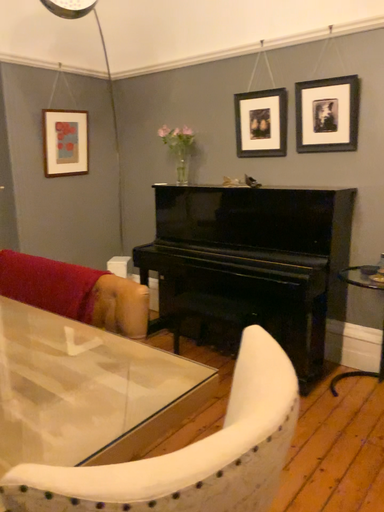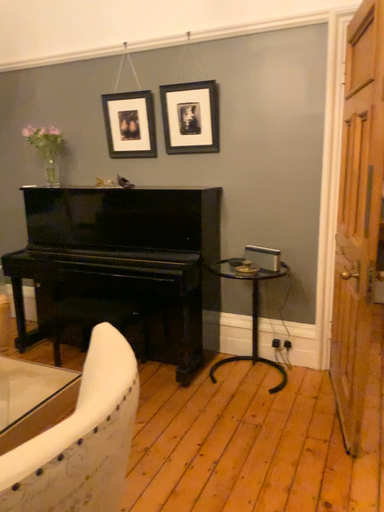
Question: How did the camera likely rotate when shooting the video?

Choices:
 (A) rotated left
 (B) rotated right

Answer: (B)